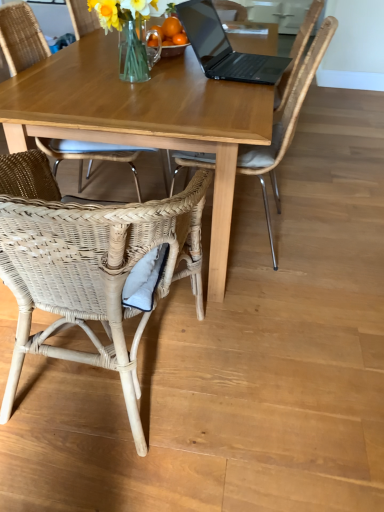
Locate an element on the screen. free region under woven rattan chair at lower left, arranged as the second chair when viewed from the right (from a real-world perspective) is located at coordinates (105, 387).